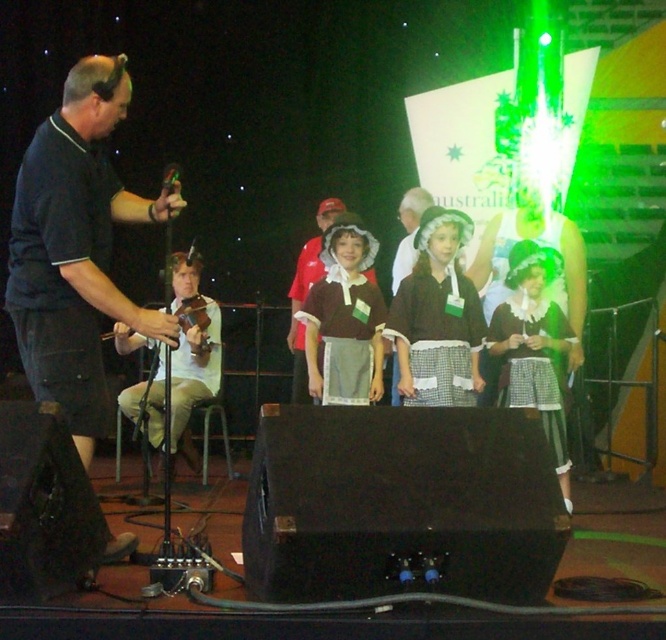
From the picture: Can you confirm if matte black dress at center is wider than light brown wood violin at left?

Incorrect, matte black dress at center's width does not surpass light brown wood violin at left's.

Is point (462, 276) less distant than point (163, 356)?

That is True.

Between point (444, 369) and point (212, 355), which one is positioned behind?

The point (212, 355) is behind.

The height and width of the screenshot is (640, 666). Identify the location of matte black dress at center. (438, 317).

Is the position of dark blue shirt at left less distant than that of matte brown dress at center?

Yes, it is in front of matte brown dress at center.

Who is more forward, (129, 195) or (316, 289)?

Point (129, 195)

Who is more forward, (31,196) or (382,362)?

Point (31,196) is more forward.

Locate an element on the screen. dark blue shirt at left is located at coordinates (77, 248).

Can you confirm if dark blue shirt at left is positioned above white checkered dress at center?

Correct, dark blue shirt at left is located above white checkered dress at center.

Who is shorter, dark blue shirt at left or white checkered dress at center?

white checkered dress at center

Between point (105, 212) and point (517, 276), which one is positioned in front?

Point (105, 212)

Identify the location of dark blue shirt at left. The width and height of the screenshot is (666, 640). (77, 248).